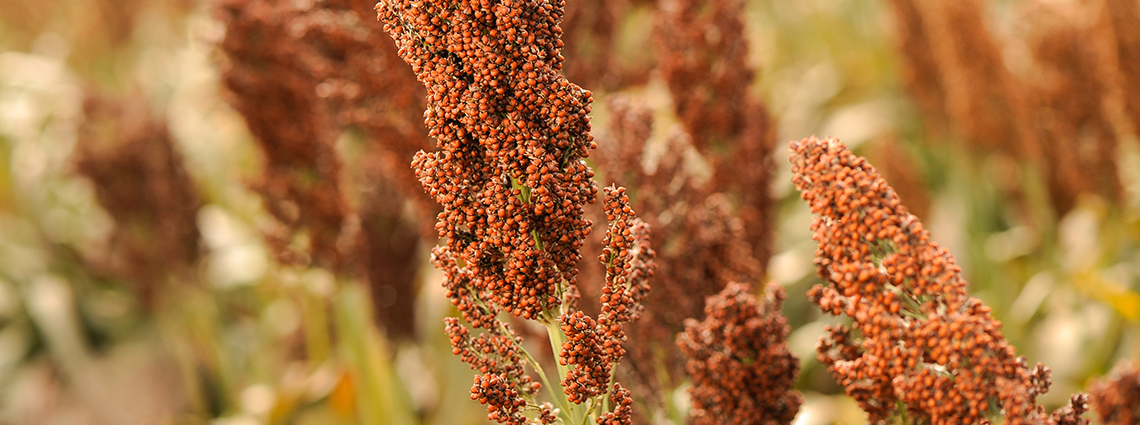
This screenshot has height=425, width=1140. Identify the location of green plants. (50, 303).